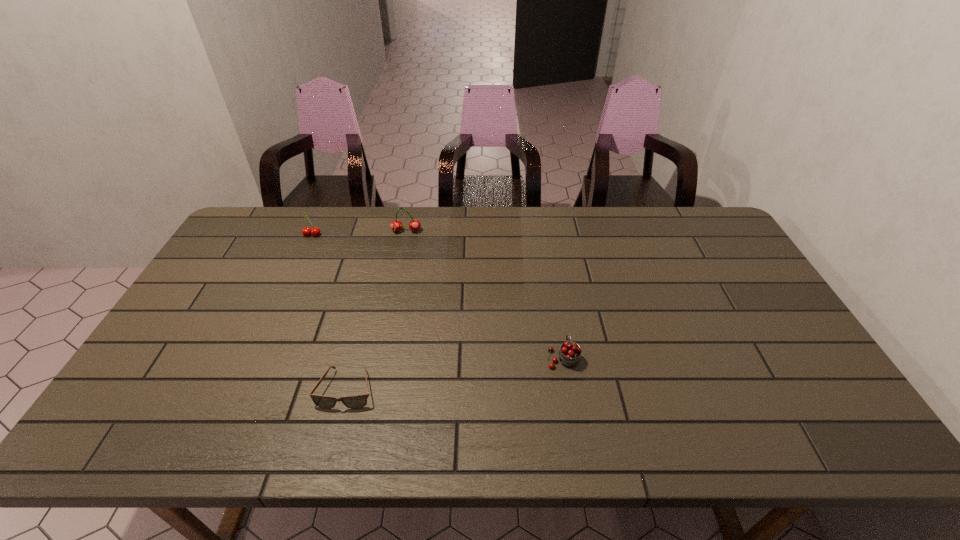
The width and height of the screenshot is (960, 540). Find the location of `the tallest cherry`. the tallest cherry is located at coordinates (396, 225).

Where is `the tallest object`? the tallest object is located at coordinates (396, 225).

This screenshot has width=960, height=540. Find the location of `the leftmost object`. the leftmost object is located at coordinates (315, 231).

Image resolution: width=960 pixels, height=540 pixels. I want to click on the rightmost object, so pyautogui.click(x=570, y=352).

The width and height of the screenshot is (960, 540). In order to click on the rightmost cherry in this screenshot , I will do `click(570, 352)`.

Locate an element on the screen. This screenshot has width=960, height=540. the shortest object is located at coordinates (358, 401).

You are a GUI agent. You are given a task and a screenshot of the screen. Output one action in this format:
    pyautogui.click(x=<x>, y=<y>)
    Task: Click on the vacant space located 0.180m with stems pointing upwards on the second cherry from right to left
    Image resolution: width=960 pixels, height=540 pixels.
    Given the screenshot: What is the action you would take?
    tap(398, 269)

The image size is (960, 540). Identify the location of vacant space located 0.280m with the stems of the leftmost object pointing upwards. (284, 296).

The height and width of the screenshot is (540, 960). Find the location of `vacant space located on the handle side of the rightmost object`. vacant space located on the handle side of the rightmost object is located at coordinates (547, 264).

At what (x,y) coordinates should I click in order to perform the action: click on blank area located 0.240m on the handle side of the rightmost object. Please return your answer as a coordinate pair (x, y). Looking at the image, I should click on (550, 282).